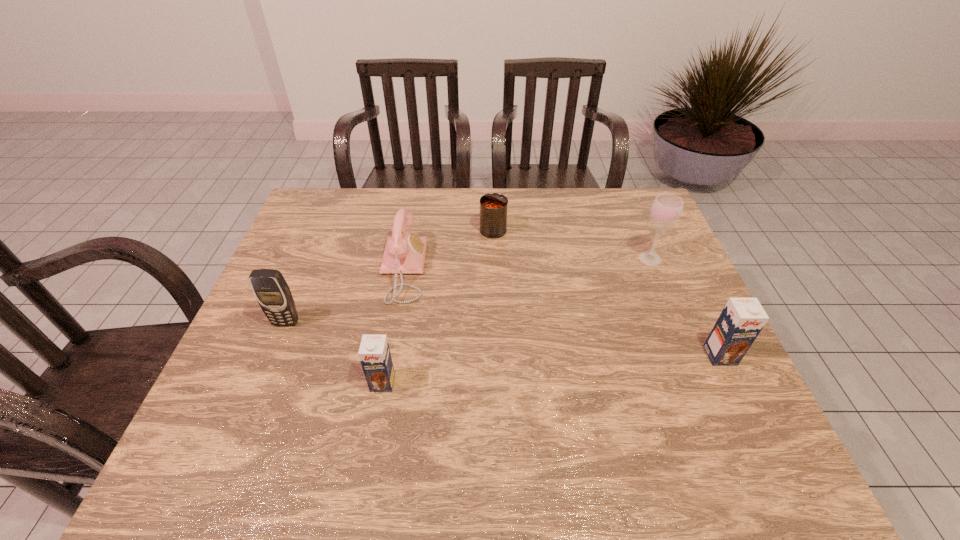
Where is `free space between the nearer chocolate milk and the telephone`? free space between the nearer chocolate milk and the telephone is located at coordinates (393, 326).

This screenshot has height=540, width=960. Identify the location of free spot between the leftmost object and the taller chocolate milk. (503, 339).

Identify the location of vacant space that is in between the can and the leftmost object. (390, 276).

The width and height of the screenshot is (960, 540). What are the coordinates of `free area in between the right chocolate milk and the leftmost object` in the screenshot? It's located at (503, 339).

You are a GUI agent. You are given a task and a screenshot of the screen. Output one action in this format:
    pyautogui.click(x=<x>, y=<y>)
    Task: Click on the free space between the cellular telephone and the wineglass
    This screenshot has height=540, width=960.
    Given the screenshot: What is the action you would take?
    pyautogui.click(x=468, y=291)

In order to click on the fourth closest object relative to the fourth object from left to right in this screenshot , I will do `click(272, 292)`.

Select which object appears as the second closest to the leftmost object. Please provide its 2D coordinates. Your answer should be formatted as a tuple, i.e. [(x, y)], where the tuple contains the x and y coordinates of a point satisfying the conditions above.

[(374, 353)]